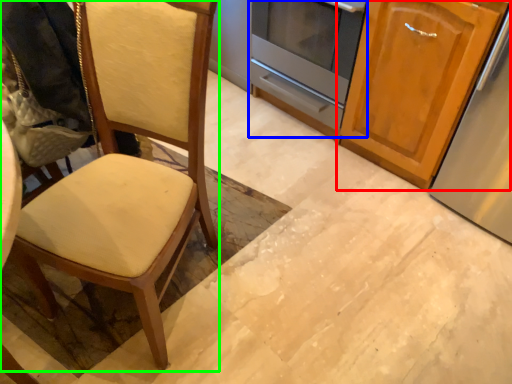
Question: Estimate the real-world distances between objects in this image. Which object is farther from cabinetry (highlighted by a red box), oven (highlighted by a blue box) or chair (highlighted by a green box)?

Choices:
 (A) oven
 (B) chair

Answer: (B)